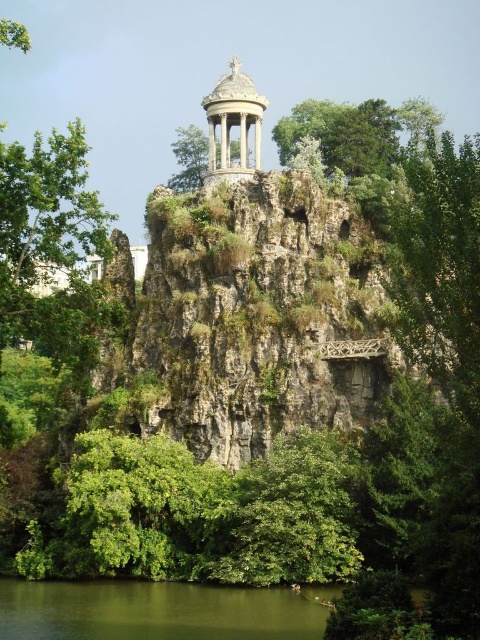
Question: Which point is closer to the camera?

Choices:
 (A) matte stone gazebo at upper center
 (B) green liquid water at lower center

Answer: (B)

Question: Can you confirm if green liquid water at lower center is smaller than green leafy tree at upper center?

Choices:
 (A) no
 (B) yes

Answer: (B)

Question: Which of the following is the closest to the observer?

Choices:
 (A) (337, 154)
 (B) (212, 168)

Answer: (B)

Question: Can you confirm if green liquid water at lower center is positioned above green leafy tree at upper center?

Choices:
 (A) yes
 (B) no

Answer: (B)

Question: Is green leafy tree at upper center positioned before matte stone gazebo at upper center?

Choices:
 (A) no
 (B) yes

Answer: (A)

Question: Considering the real-world distances, which object is farthest from the matte stone gazebo at upper center?

Choices:
 (A) green liquid water at lower center
 (B) green leafy tree at upper center

Answer: (A)